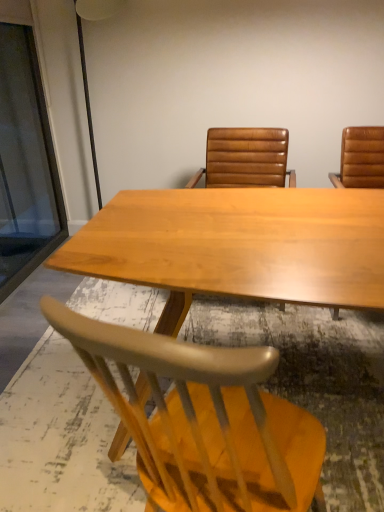
Question: Which direction should I rotate to face light wood chair at lower center, positioned as the 2th chair in top-to-bottom order, — up or down?

Choices:
 (A) up
 (B) down

Answer: (B)

Question: Does leather at center, acting as the 1th chair starting from the top, have a greater width compared to light brown wood table at center?

Choices:
 (A) no
 (B) yes

Answer: (A)

Question: Is leather at center, acting as the 1th chair starting from the top, at the right side of light brown wood table at center?

Choices:
 (A) yes
 (B) no

Answer: (A)

Question: From a real-world perspective, is leather at center, acting as the 1th chair starting from the top, positioned under light brown wood table at center based on gravity?

Choices:
 (A) yes
 (B) no

Answer: (B)

Question: Does leather at center, the 2th chair from the bottom, have a larger size compared to light brown wood table at center?

Choices:
 (A) yes
 (B) no

Answer: (B)

Question: Are leather at center, acting as the 1th chair starting from the top, and light brown wood table at center located far from each other?

Choices:
 (A) yes
 (B) no

Answer: (B)

Question: Does leather at center, the 2th chair from the bottom, have a lesser height compared to light brown wood table at center?

Choices:
 (A) yes
 (B) no

Answer: (B)

Question: From the image's perspective, does leather at center, acting as the 1th chair starting from the top, appear lower than light wood chair at lower center, the first chair from the bottom?

Choices:
 (A) yes
 (B) no

Answer: (B)

Question: Is leather at center, the 2th chair from the bottom, at the right side of light wood chair at lower center, the first chair from the bottom?

Choices:
 (A) no
 (B) yes

Answer: (B)

Question: Is leather at center, the 2th chair from the bottom, at the left side of light wood chair at lower center, the first chair from the bottom?

Choices:
 (A) yes
 (B) no

Answer: (B)

Question: Are leather at center, acting as the 1th chair starting from the top, and light wood chair at lower center, positioned as the 2th chair in top-to-bottom order, far apart?

Choices:
 (A) no
 (B) yes

Answer: (B)

Question: Can you confirm if leather at center, acting as the 1th chair starting from the top, is bigger than light wood chair at lower center, the first chair from the bottom?

Choices:
 (A) no
 (B) yes

Answer: (B)

Question: Is the position of leather at center, acting as the 1th chair starting from the top, more distant than that of light wood chair at lower center, positioned as the 2th chair in top-to-bottom order?

Choices:
 (A) yes
 (B) no

Answer: (A)

Question: From a real-world perspective, does light wood chair at lower center, positioned as the 2th chair in top-to-bottom order, stand above leather at center, the 2th chair from the bottom?

Choices:
 (A) no
 (B) yes

Answer: (A)